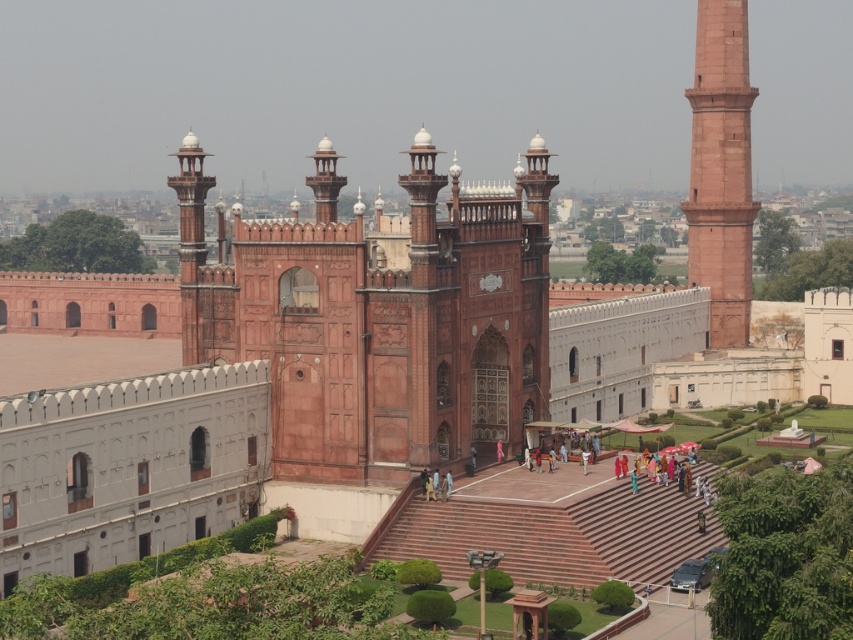
Question: Is reddish-brown stone archway at center to the left of smooth sandstone minaret at right from the viewer's perspective?

Choices:
 (A) no
 (B) yes

Answer: (B)

Question: Among these objects, which one is farthest from the camera?

Choices:
 (A) smooth sandstone minaret at right
 (B) reddish-brown stone archway at center

Answer: (A)

Question: Is reddish-brown stone archway at center positioned at the back of smooth sandstone minaret at right?

Choices:
 (A) yes
 (B) no

Answer: (B)

Question: Which object is farther from the camera taking this photo?

Choices:
 (A) reddish-brown stone archway at center
 (B) smooth sandstone minaret at right

Answer: (B)

Question: Considering the relative positions of reddish-brown stone archway at center and smooth sandstone minaret at right in the image provided, where is reddish-brown stone archway at center located with respect to smooth sandstone minaret at right?

Choices:
 (A) left
 (B) right

Answer: (A)